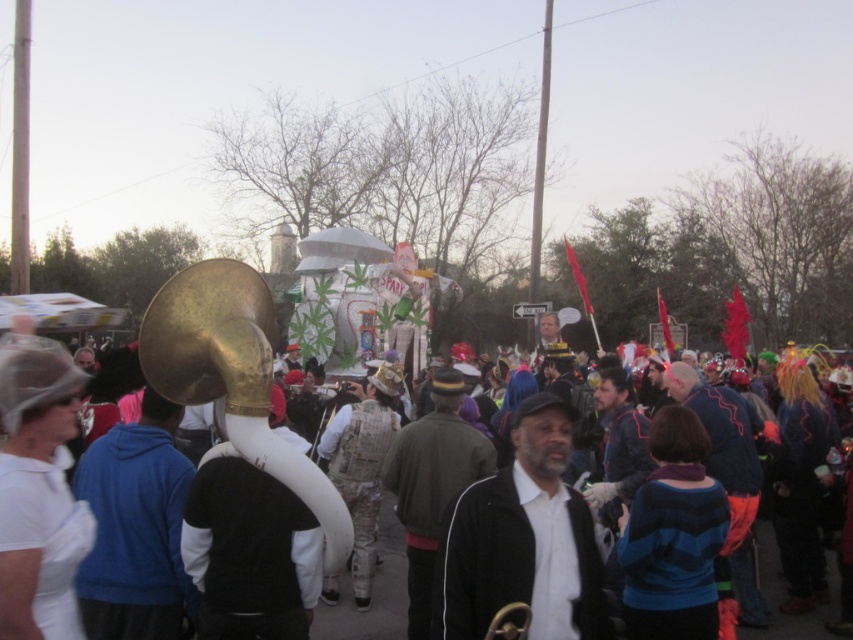
Consider the image. Is gold shiny bass horn at center positioned in front of dark green jacket at center?

No, it is behind dark green jacket at center.

Does gold shiny bass horn at center have a lesser height compared to dark green jacket at center?

Incorrect, gold shiny bass horn at center's height does not fall short of dark green jacket at center's.

Which is in front, point (300, 496) or point (445, 404)?

Positioned in front is point (300, 496).

Locate an element on the screen. The height and width of the screenshot is (640, 853). gold shiny bass horn at center is located at coordinates (234, 378).

Is the position of blue fleece jacket at center more distant than that of dark green jacket at center?

No, it is not.

Measure the distance between blue fleece jacket at center and camera.

The distance of blue fleece jacket at center from camera is 158.32 feet.

Image resolution: width=853 pixels, height=640 pixels. In order to click on blue fleece jacket at center in this screenshot , I will do `click(135, 529)`.

Is black matte jacket at center to the left of white matte crowd at center from the viewer's perspective?

In fact, black matte jacket at center is to the right of white matte crowd at center.

What do you see at coordinates (524, 540) in the screenshot? This screenshot has height=640, width=853. I see `black matte jacket at center` at bounding box center [524, 540].

Who is more distant from viewer, (460, 612) or (347, 620)?

The point (347, 620) is behind.

Locate an element on the screen. The height and width of the screenshot is (640, 853). black matte jacket at center is located at coordinates (524, 540).